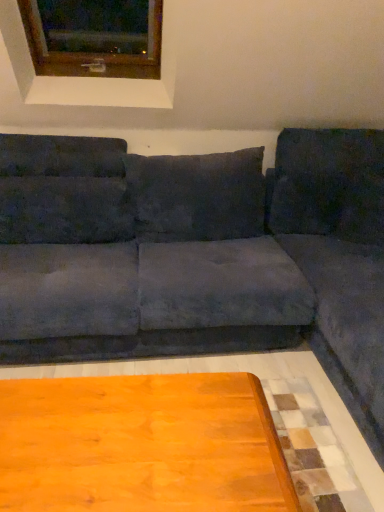
Question: Considering the positions of point (307, 152) and point (48, 219), is point (307, 152) closer or farther from the camera than point (48, 219)?

Choices:
 (A) farther
 (B) closer

Answer: (A)

Question: Visually, is suede gray couch at center positioned to the left or to the right of suede-like dark gray pillow at upper left, marked as the first pillow in a left-to-right arrangement?

Choices:
 (A) right
 (B) left

Answer: (A)

Question: Which is farther from the suede gray couch at center?

Choices:
 (A) wooden table at lower center
 (B) wooden frame at upper left
 (C) velvet dark gray pillow at right, which is the 3th pillow in left-to-right order
 (D) dark gray suede pillow at center, the 2th pillow when ordered from right to left
 (E) suede-like dark gray pillow at upper left, positioned as the 3th pillow in right-to-left order

Answer: (B)

Question: Which is nearer to the dark gray suede pillow at center, marked as the second pillow in a left-to-right arrangement?

Choices:
 (A) suede gray couch at center
 (B) suede-like dark gray pillow at upper left, positioned as the 3th pillow in right-to-left order
 (C) wooden frame at upper left
 (D) wooden table at lower center
 (E) velvet dark gray pillow at right, which is the 3th pillow in left-to-right order

Answer: (A)